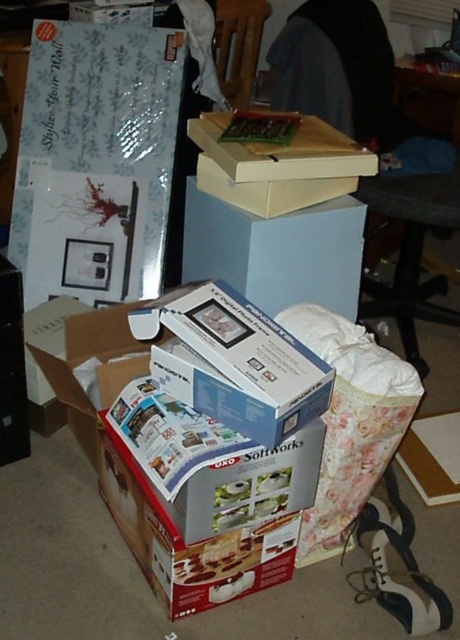
You are organizing the boxes in the living room. You need to place the white matte box at center and the matte cardboard box at upper center in a row from left to right. Which box should be placed first on the left side?

The white matte box at center should be placed first on the left side since it is already positioned to the left of the matte cardboard box at upper center.

You are organizing a storage space and need to place the white matte box at center and the light blue cardboard box at center next to each other. What is the minimum width of the shelf required to accommodate both boxes without overlapping?

The white matte box at center and the light blue cardboard box at center are 12.24 inches apart. To place them next to each other without overlapping, the shelf must be at least 12.24 inches wide.